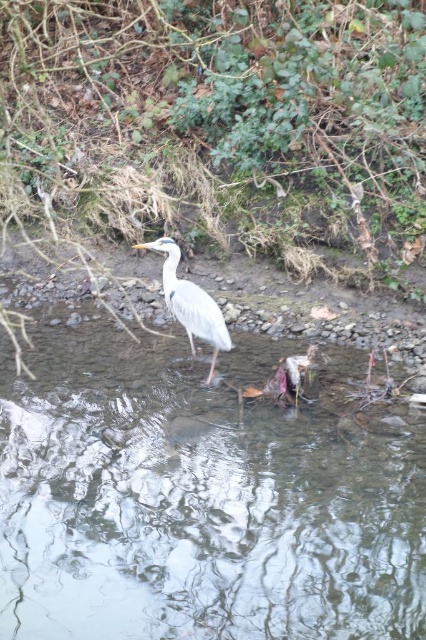
You are a researcher studying water clarity in natural habitats. You observe the clear water at center in the scene. Based on its position, can you determine if it is positioned in the lower half of the image?

The clear water at center is located at point coordinates approximately 0.462 on the vertical axis. Since the vertical axis typically ranges from 0 at the bottom to 1 at the top, a value of 0.462 places it just above the halfway point. Therefore, it is positioned in the upper half of the image, not the lower half.

In the scene shown: You are a photographer trying to capture the gray feathered heron at center in the clear water at center. Since the water is higher than the heron, will the heron be fully submerged in the water?

The clear water at center has a greater height compared to the gray feathered heron at center, meaning the water is deeper than the heron. However, since herons are known to stand in shallow water with their long legs, it is likely that the heron is not fully submerged. Only its legs and possibly part of its body may be in the water, but the majority of its body, including its neck and head, remains above the water surface.